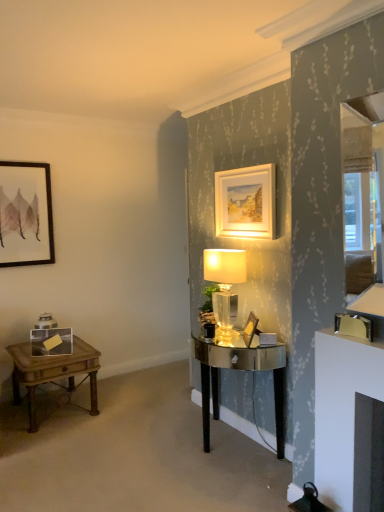
Question: Which direction should I rotate to face matte gold picture frame at upper center, the third picture frame when ordered from bottom to top, — up or down?

Choices:
 (A) up
 (B) down

Answer: (A)

Question: From the image's perspective, is wooden side table at left located above translucent glass lamp at center?

Choices:
 (A) yes
 (B) no

Answer: (B)

Question: From a real-world perspective, is wooden side table at left located beneath translucent glass lamp at center?

Choices:
 (A) no
 (B) yes

Answer: (B)

Question: Does wooden side table at left come behind translucent glass lamp at center?

Choices:
 (A) yes
 (B) no

Answer: (A)

Question: Is wooden side table at left to the right of translucent glass lamp at center from the viewer's perspective?

Choices:
 (A) no
 (B) yes

Answer: (A)

Question: Is wooden side table at left shorter than translucent glass lamp at center?

Choices:
 (A) no
 (B) yes

Answer: (B)

Question: From the image's perspective, does wooden side table at left appear lower than translucent glass lamp at center?

Choices:
 (A) no
 (B) yes

Answer: (B)

Question: From a real-world perspective, is wooden picture frame at center, which is the 1th picture frame in front-to-back order, positioned over wooden side table at left based on gravity?

Choices:
 (A) yes
 (B) no

Answer: (A)

Question: Is wooden picture frame at center, which is the first picture frame from right to left, shorter than wooden side table at left?

Choices:
 (A) yes
 (B) no

Answer: (A)

Question: From a real-world perspective, is wooden picture frame at center, which is the third picture frame from back to front, physically below wooden side table at left?

Choices:
 (A) yes
 (B) no

Answer: (B)

Question: Is wooden picture frame at center, placed as the 1th picture frame when sorted from bottom to top, wider than wooden side table at left?

Choices:
 (A) no
 (B) yes

Answer: (A)

Question: From the image's perspective, does wooden picture frame at center, acting as the 3th picture frame starting from the left, appear higher than wooden side table at left?

Choices:
 (A) yes
 (B) no

Answer: (A)

Question: Can you confirm if wooden picture frame at center, which is the first picture frame from right to left, is smaller than wooden side table at left?

Choices:
 (A) yes
 (B) no

Answer: (A)

Question: Could translucent glass lamp at center be considered to be inside matte black picture frame at upper left, which ranks as the first picture frame in left-to-right order?

Choices:
 (A) yes
 (B) no

Answer: (B)